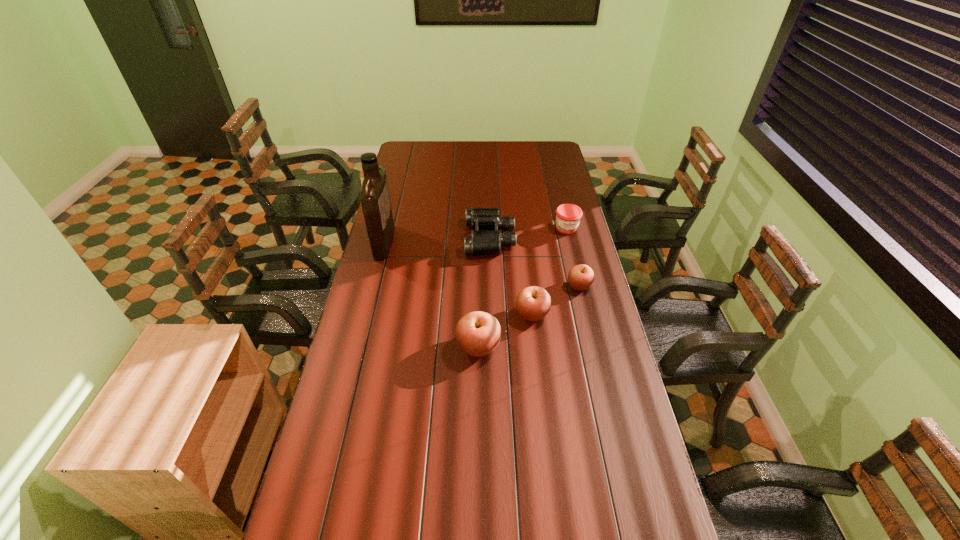
Find the location of a particular element. The width and height of the screenshot is (960, 540). free point that keeps the apples evenly spaced on the left is located at coordinates (416, 384).